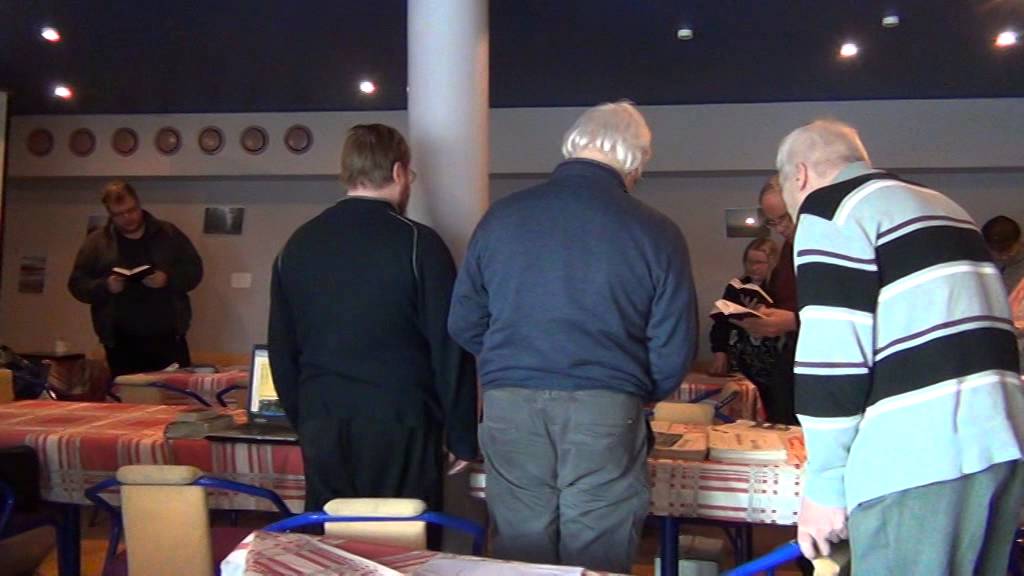
Find the location of a particular element. smoke detectors is located at coordinates (894, 21), (681, 37).